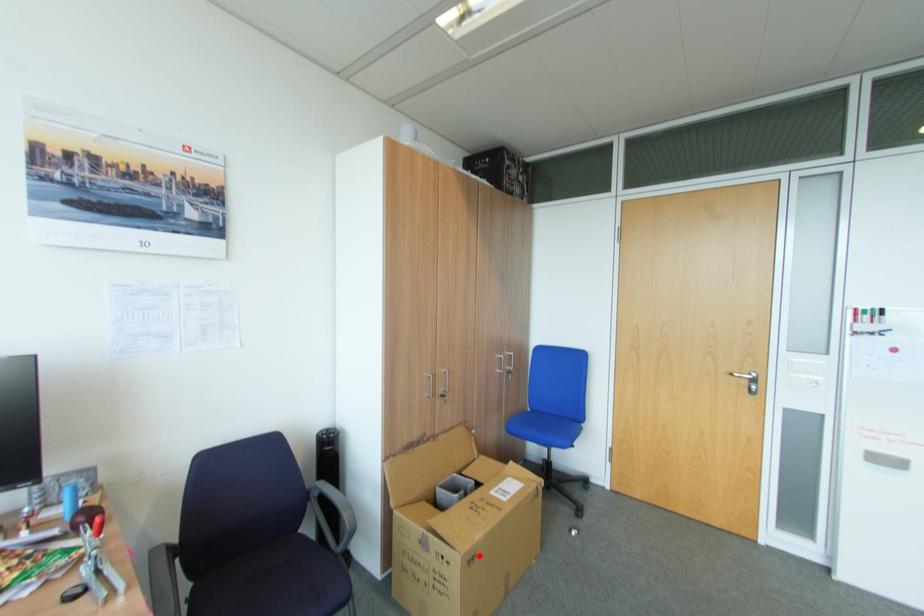
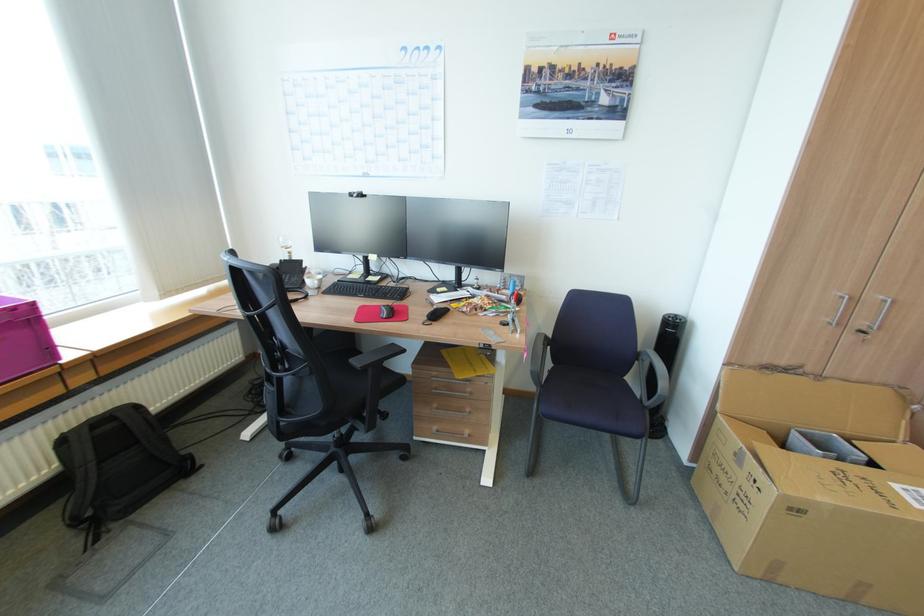
The point at the highlighted location is marked in the first image. Where is the corresponding point in the second image?

(804, 511)